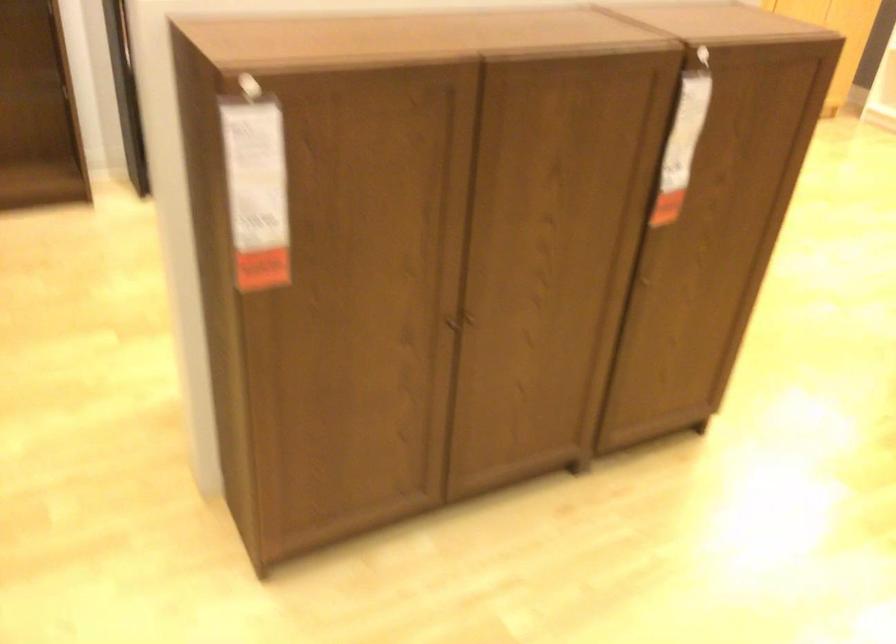
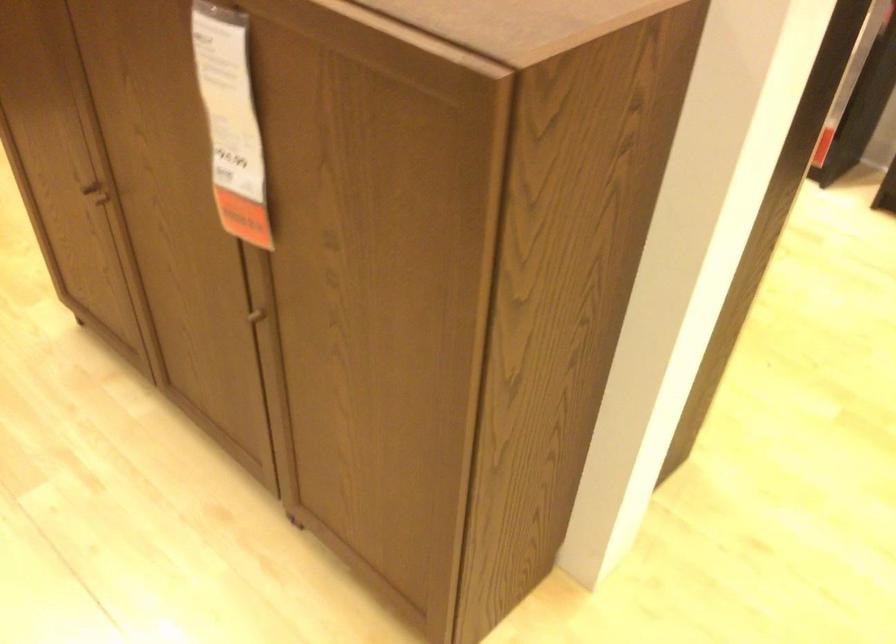
The point at (672, 142) is marked in the first image. Where is the corresponding point in the second image?

(230, 122)